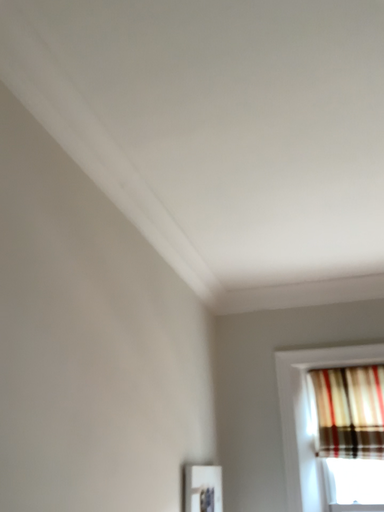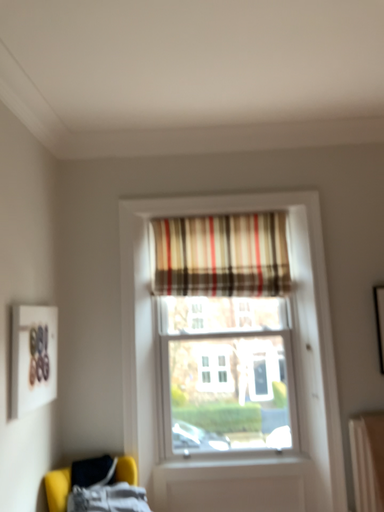
Question: How did the camera likely rotate when shooting the video?

Choices:
 (A) rotated left
 (B) rotated right

Answer: (B)